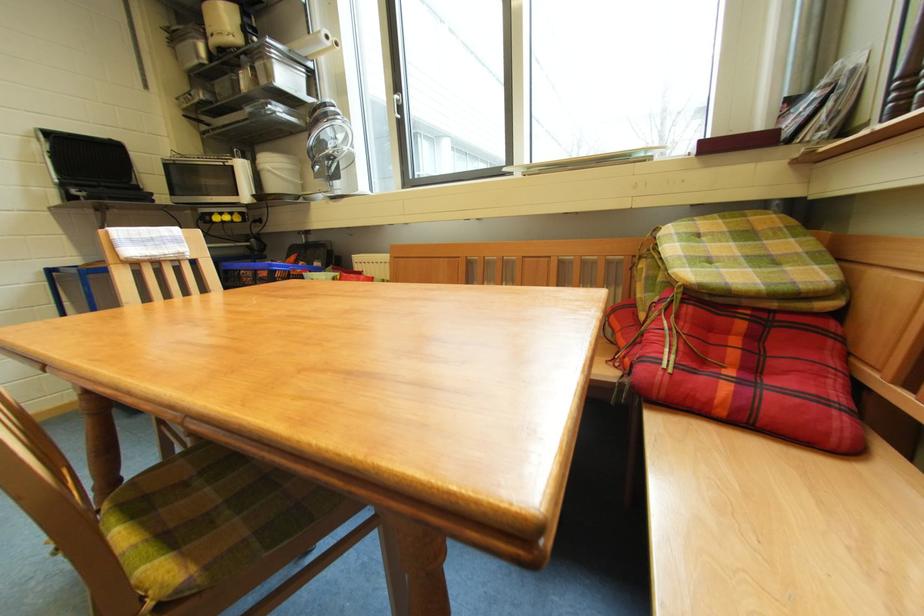
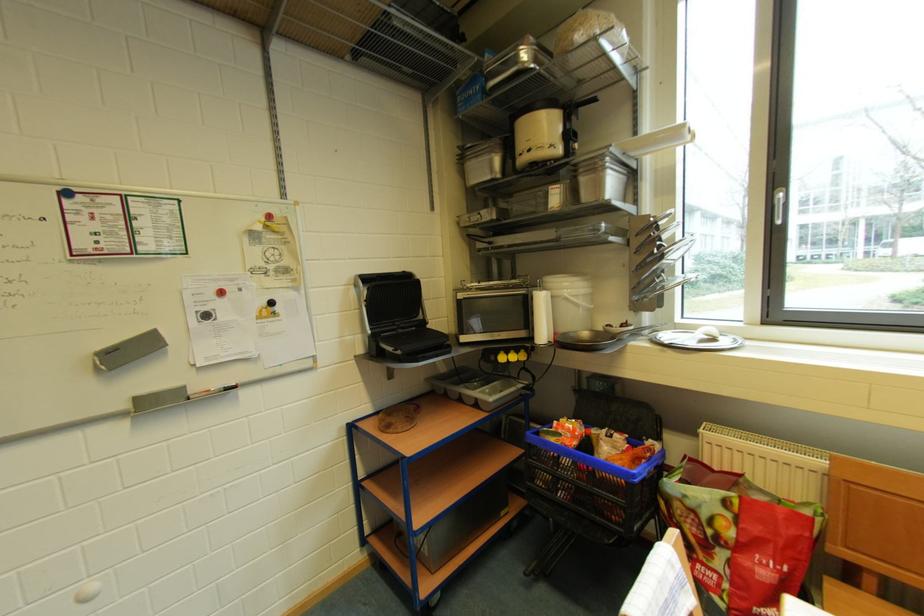
Where in the second image is the point corresponding to pixel 215 221 from the first image?

(500, 361)